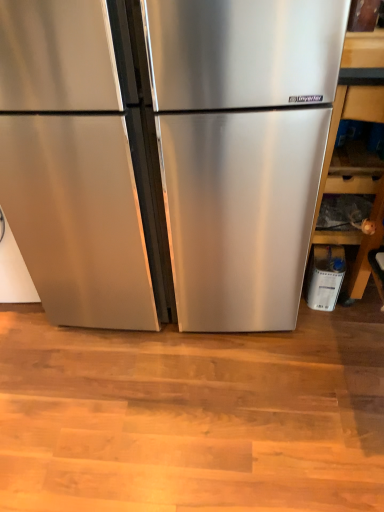
The width and height of the screenshot is (384, 512). What do you see at coordinates (169, 158) in the screenshot?
I see `stainless steel refrigerator at center` at bounding box center [169, 158].

You are a GUI agent. You are given a task and a screenshot of the screen. Output one action in this format:
    pyautogui.click(x=<x>, y=<y>)
    Task: Click on the stainless steel refrigerator at center
    The image size is (384, 512).
    Given the screenshot: What is the action you would take?
    pyautogui.click(x=169, y=158)

You are a GUI agent. You are given a task and a screenshot of the screen. Output one action in this format:
    pyautogui.click(x=<x>, y=<y>)
    Task: Click on the stainless steel refrigerator at center
    
    Given the screenshot: What is the action you would take?
    pyautogui.click(x=169, y=158)